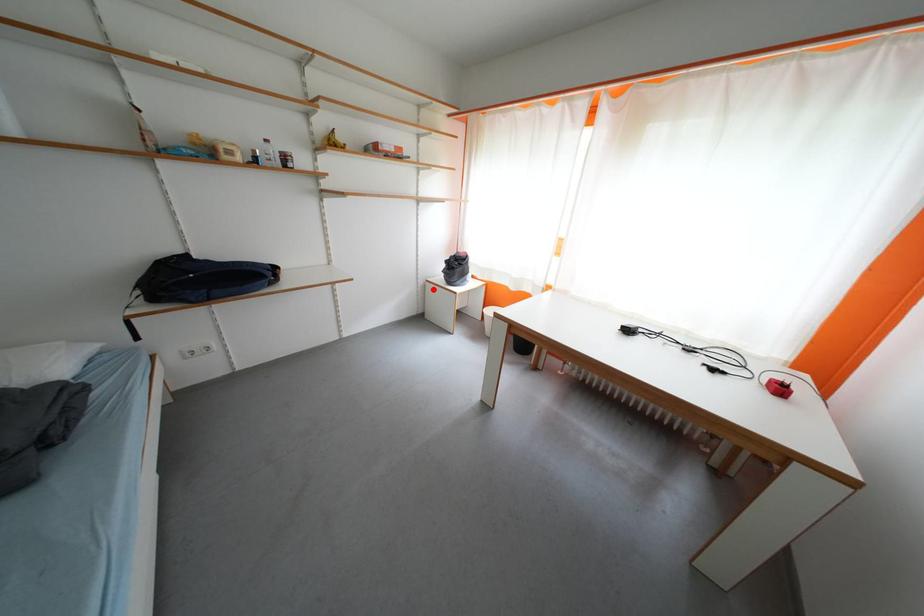
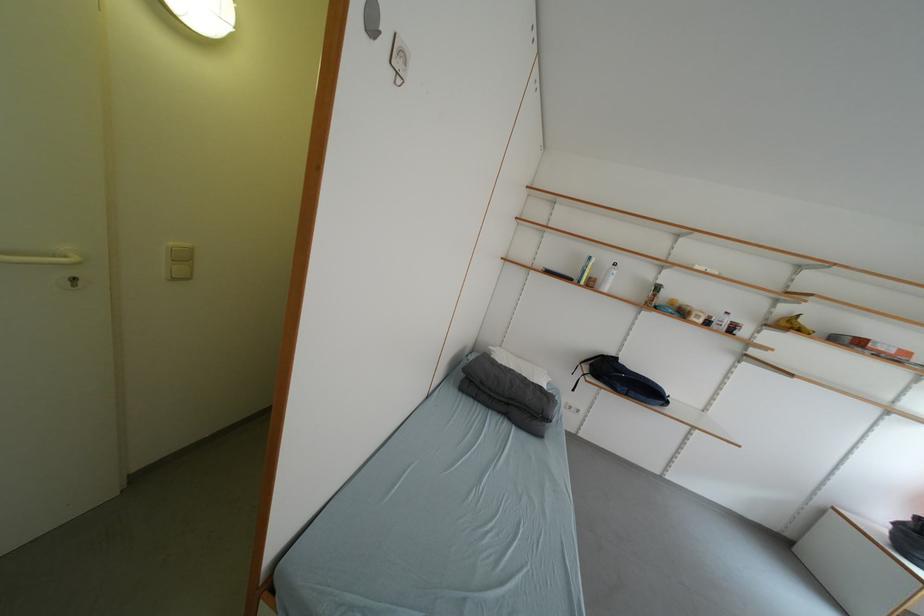
In the second image, find the point that corresponds to the highlighted location in the first image.

(832, 515)